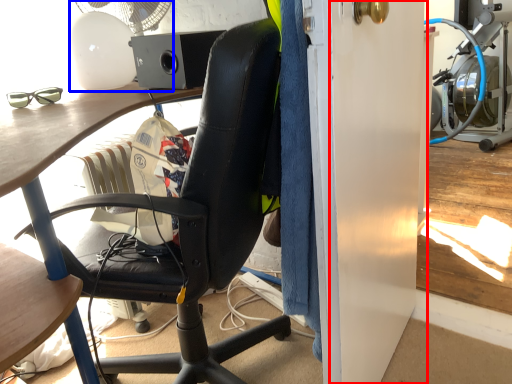
Question: Which object appears closest to the camera in this image, screen door (highlighted by a red box) or mechanical fan (highlighted by a blue box)?

Choices:
 (A) screen door
 (B) mechanical fan

Answer: (A)